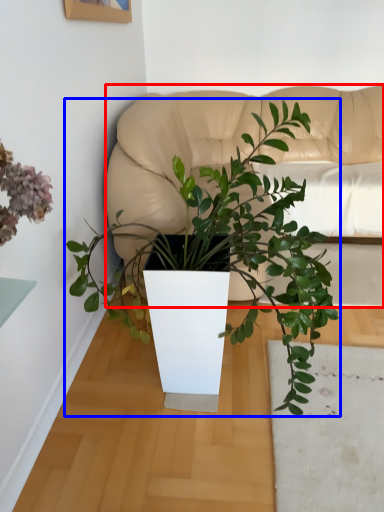
Question: Which object appears closest to the camera in this image, couch (highlighted by a red box) or houseplant (highlighted by a blue box)?

Choices:
 (A) couch
 (B) houseplant

Answer: (B)